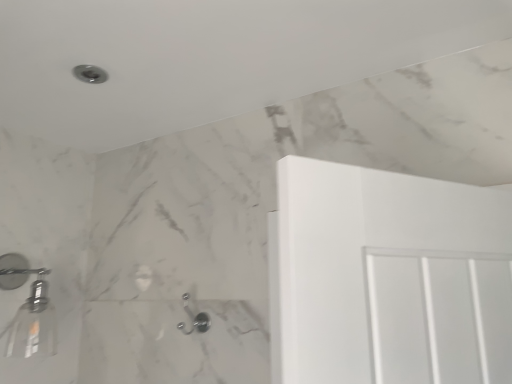
Question: Is metallic silver showerhead at left, arranged as the second shower when viewed from the top, further to the viewer compared to satin nickel hook at lower center, which is the third shower from left to right?

Choices:
 (A) no
 (B) yes

Answer: (A)

Question: Can you confirm if metallic silver showerhead at left, arranged as the second shower when viewed from the top, is shorter than satin nickel hook at lower center, which ranks as the first shower in bottom-to-top order?

Choices:
 (A) no
 (B) yes

Answer: (A)

Question: From a real-world perspective, is metallic silver showerhead at left, positioned as the 1th shower in left-to-right order, beneath satin nickel hook at lower center, which ranks as the first shower in bottom-to-top order?

Choices:
 (A) no
 (B) yes

Answer: (A)

Question: Is metallic silver showerhead at left, arranged as the second shower when viewed from the top, at the left side of satin nickel hook at lower center, which is the third shower from left to right?

Choices:
 (A) yes
 (B) no

Answer: (A)

Question: Are metallic silver showerhead at left, arranged as the second shower when viewed from the top, and satin nickel hook at lower center, the 3th shower in the top-to-bottom sequence, located far from each other?

Choices:
 (A) no
 (B) yes

Answer: (A)

Question: From the image's perspective, is metallic silver showerhead at left, positioned as the 3th shower in right-to-left order, below satin nickel hook at lower center, the 3th shower in the top-to-bottom sequence?

Choices:
 (A) yes
 (B) no

Answer: (B)

Question: Is metallic silver showerhead at left, which appears as the second shower when ordered from the bottom, to the right of matte silver shower at upper left, the 3th shower ordered from the bottom, from the viewer's perspective?

Choices:
 (A) no
 (B) yes

Answer: (A)

Question: Are metallic silver showerhead at left, which appears as the second shower when ordered from the bottom, and matte silver shower at upper left, the 2th shower when ordered from right to left, making contact?

Choices:
 (A) no
 (B) yes

Answer: (A)

Question: Can you confirm if metallic silver showerhead at left, positioned as the 3th shower in right-to-left order, is thinner than matte silver shower at upper left, the 3th shower ordered from the bottom?

Choices:
 (A) no
 (B) yes

Answer: (A)

Question: Would you say metallic silver showerhead at left, positioned as the 1th shower in left-to-right order, contains matte silver shower at upper left, the 2th shower when ordered from right to left?

Choices:
 (A) no
 (B) yes

Answer: (A)

Question: Is metallic silver showerhead at left, which appears as the second shower when ordered from the bottom, smaller than matte silver shower at upper left, placed as the 1th shower when sorted from top to bottom?

Choices:
 (A) yes
 (B) no

Answer: (B)

Question: Does metallic silver showerhead at left, which appears as the second shower when ordered from the bottom, appear on the left side of matte silver shower at upper left, which appears as the 2th shower when viewed from the left?

Choices:
 (A) no
 (B) yes

Answer: (B)

Question: Is satin nickel hook at lower center, which ranks as the first shower in right-to-left order, aimed at matte silver shower at upper left, which appears as the 2th shower when viewed from the left?

Choices:
 (A) yes
 (B) no

Answer: (B)